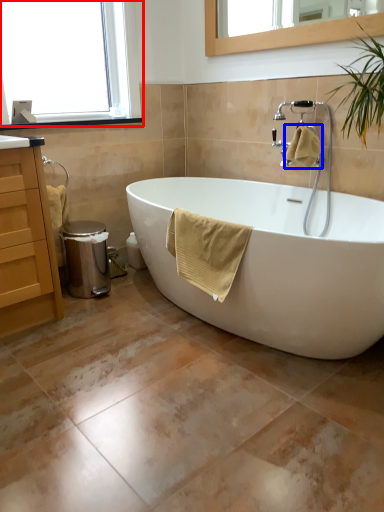
Question: Among these objects, which one is nearest to the camera, window (highlighted by a red box) or bath towel (highlighted by a blue box)?

Choices:
 (A) window
 (B) bath towel

Answer: (A)